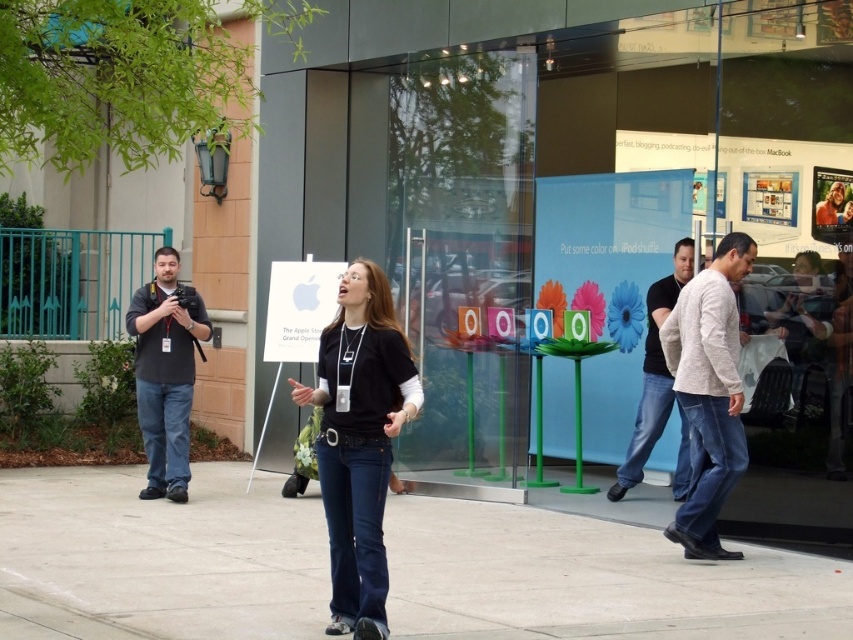
Question: Which point appears closest to the camera in this image?

Choices:
 (A) (355, 506)
 (B) (833, 221)

Answer: (A)

Question: Does black matte shirt at center have a greater width compared to light gray sweater at right?

Choices:
 (A) yes
 (B) no

Answer: (A)

Question: Does smooth concrete pavement at center appear over white paper at center?

Choices:
 (A) yes
 (B) no

Answer: (B)

Question: Which point is farther to the camera?

Choices:
 (A) (292, 314)
 (B) (264, 253)

Answer: (B)

Question: Is light gray sweater at right behind black cotton shirt at center?

Choices:
 (A) yes
 (B) no

Answer: (B)

Question: Among these objects, which one is nearest to the camera?

Choices:
 (A) translucent glass display at center
 (B) white paper at center
 (C) black cotton shirt at center

Answer: (C)